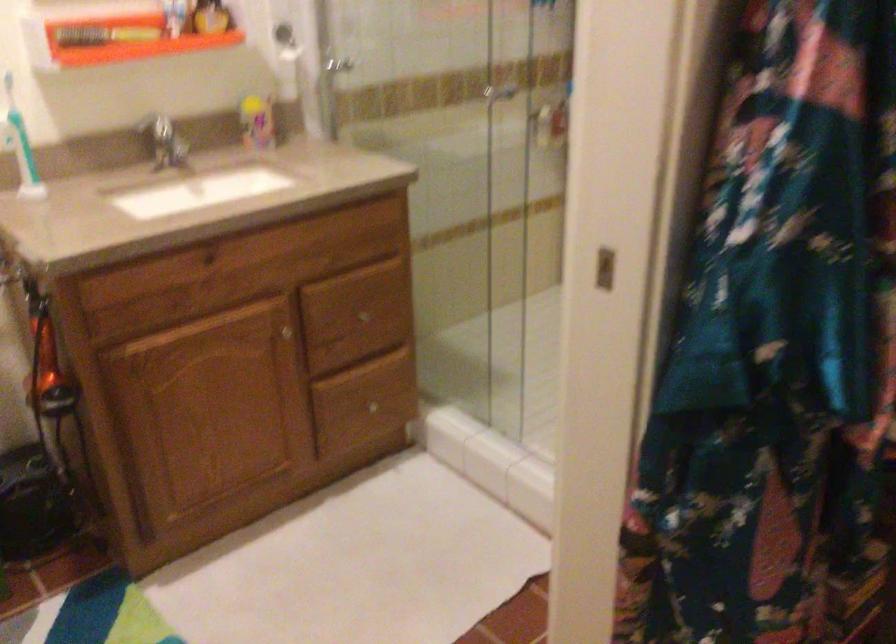
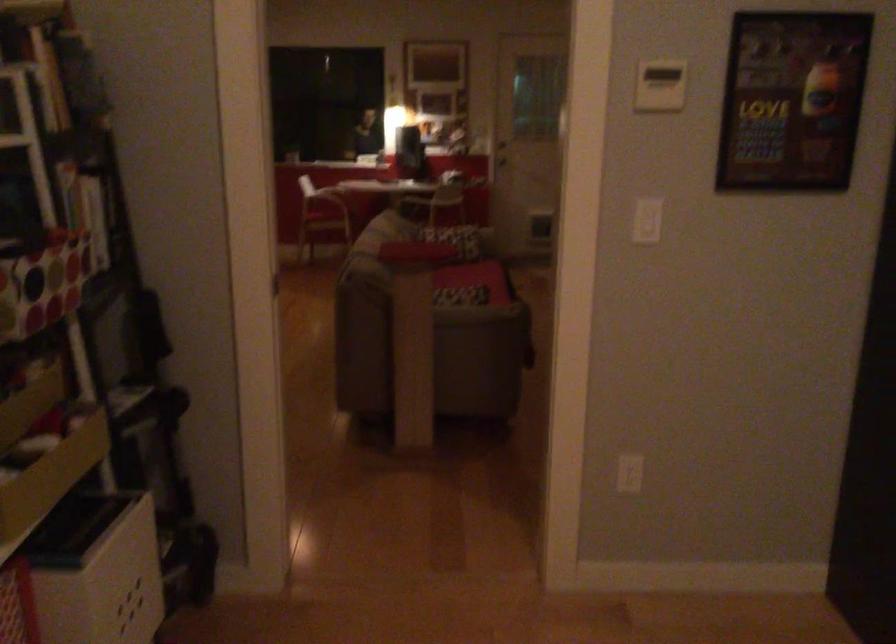
Question: The camera is either moving clockwise (left) or counter-clockwise (right) around the object. The first image is from the beginning of the video and the second image is from the end. Is the camera moving left or right when shooting the video?

Choices:
 (A) Left
 (B) Right

Answer: (A)